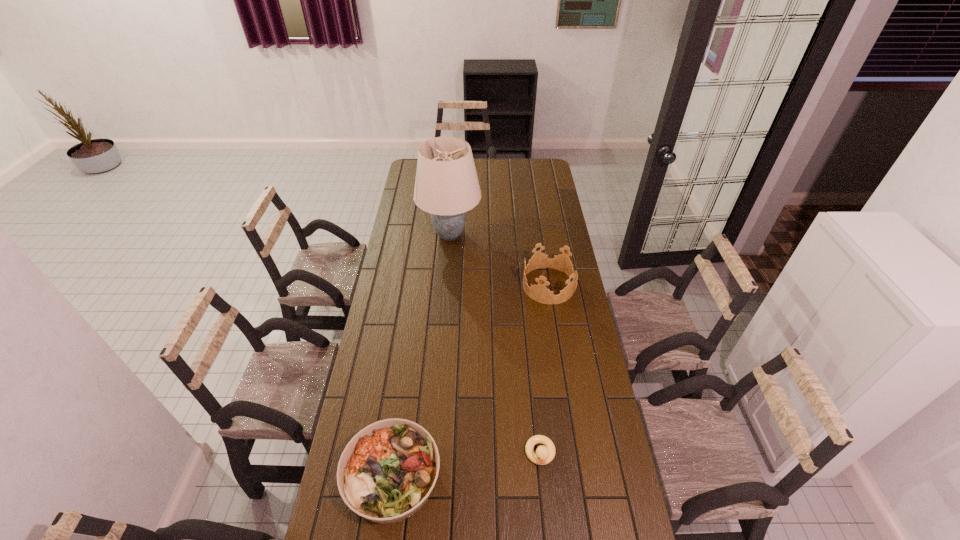
Find the location of a particular element. The image size is (960, 540). free space located on the back of the salad plate is located at coordinates (404, 393).

At what (x,y) coordinates should I click in order to perform the action: click on free spot located at the beak of the duckling. Please return your answer as a coordinate pair (x, y). Looking at the image, I should click on (546, 516).

This screenshot has width=960, height=540. I want to click on lampshade positioned at the left edge, so click(x=446, y=186).

Locate an element on the screen. The width and height of the screenshot is (960, 540). salad plate present at the left edge is located at coordinates (386, 473).

Locate an element on the screen. object that is at the right edge is located at coordinates (539, 292).

The image size is (960, 540). I want to click on free spot at the left edge of the desktop, so click(398, 319).

In the image, there is a desktop. Identify the location of vacant space at the right edge. Image resolution: width=960 pixels, height=540 pixels. (556, 204).

At what (x,y) coordinates should I click in order to perform the action: click on free space at the far right corner of the desktop. Please return your answer as a coordinate pair (x, y). Looking at the image, I should click on coord(537,173).

Where is `free space that is in between the farthest object and the salad plate`? The width and height of the screenshot is (960, 540). free space that is in between the farthest object and the salad plate is located at coordinates (x=421, y=356).

This screenshot has height=540, width=960. In order to click on free spot between the tiara and the farthest object in this screenshot , I will do click(x=499, y=260).